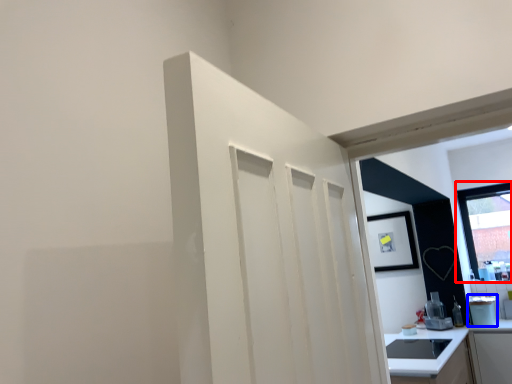
Question: Among these objects, which one is farthest to the camera, window (highlighted by a red box) or appliance (highlighted by a blue box)?

Choices:
 (A) window
 (B) appliance

Answer: (A)